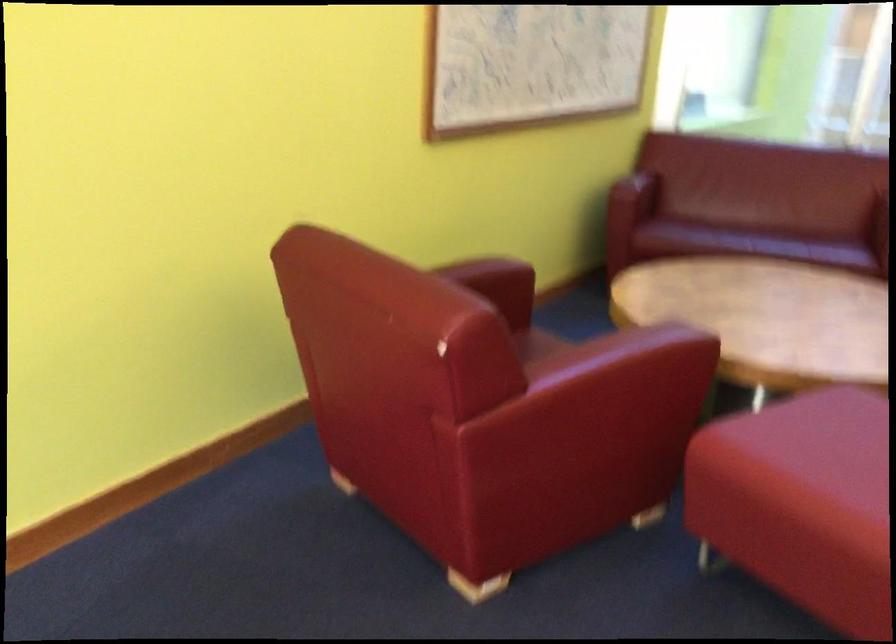
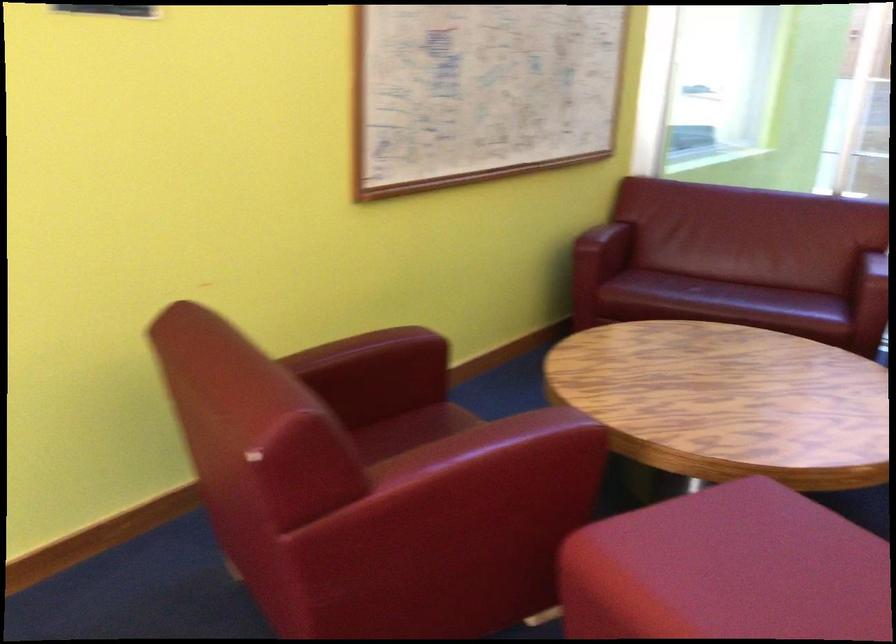
Find the pixel in the second image that matches point (475, 288) in the first image.

(375, 363)